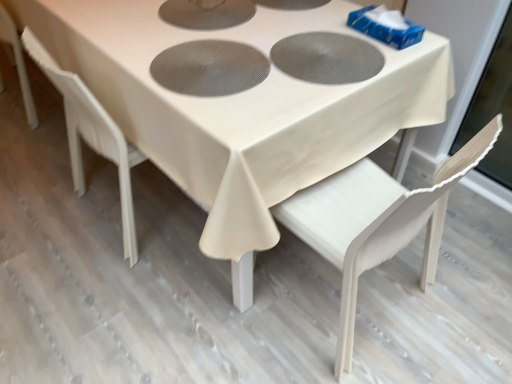
This screenshot has width=512, height=384. What are the coordinates of `white fabric table at center` in the screenshot? It's located at (241, 109).

Which of these two, white fabric table at center or white plastic chair at lower left, arranged as the 2th chair when viewed from the right, is wider?

white fabric table at center is wider.

Between white fabric table at center and white plastic chair at lower left, arranged as the 2th chair when viewed from the right, which one has less height?

Standing shorter between the two is white fabric table at center.

Is white fabric table at center positioned beyond the bounds of white plastic chair at lower left, acting as the first chair starting from the left?

Yes, white fabric table at center is located beyond the bounds of white plastic chair at lower left, acting as the first chair starting from the left.

Which object is positioned more to the left, white fabric table at center or white plastic chair at lower left, arranged as the 2th chair when viewed from the right?

From the viewer's perspective, white fabric table at center appears more on the left side.

Is white fabric table at center positioned far away from white matte chair at lower right, acting as the second chair starting from the left?

white fabric table at center is actually quite close to white matte chair at lower right, acting as the second chair starting from the left.

Could you tell me if white fabric table at center is turned towards white matte chair at lower right, the 1th chair from the right?

No, white fabric table at center is not facing towards white matte chair at lower right, the 1th chair from the right.

Does white fabric table at center have a greater width compared to white matte chair at lower right, the 1th chair from the right?

Yes.

Does white fabric table at center have a larger size compared to white matte chair at lower right, the 1th chair from the right?

Indeed, white fabric table at center has a larger size compared to white matte chair at lower right, the 1th chair from the right.

In the image, is white matte chair at lower right, acting as the second chair starting from the left, positioned in front of or behind white plastic chair at lower left, acting as the first chair starting from the left?

white matte chair at lower right, acting as the second chair starting from the left, is positioned closer to the viewer than white plastic chair at lower left, acting as the first chair starting from the left.

From a real-world perspective, which is physically above, white matte chair at lower right, acting as the second chair starting from the left, or white plastic chair at lower left, arranged as the 2th chair when viewed from the right?

white matte chair at lower right, acting as the second chair starting from the left, from a real-world perspective.

Which is more distant, (361,218) or (85,130)?

Positioned behind is point (85,130).

At what (x,y) coordinates should I click in order to perform the action: click on chair above the white plastic chair at lower left, arranged as the 2th chair when viewed from the right (from a real-world perspective). Please return your answer as a coordinate pair (x, y). Looking at the image, I should click on (375, 222).

From a real-world perspective, is white plastic chair at lower left, arranged as the 2th chair when viewed from the right, physically below white matte chair at lower right, acting as the second chair starting from the left?

Yes.

Considering the sizes of objects white plastic chair at lower left, acting as the first chair starting from the left, and white matte chair at lower right, acting as the second chair starting from the left, in the image provided, who is wider, white plastic chair at lower left, acting as the first chair starting from the left, or white matte chair at lower right, acting as the second chair starting from the left,?

white plastic chair at lower left, acting as the first chair starting from the left.

Visually, is white plastic chair at lower left, acting as the first chair starting from the left, positioned to the left or to the right of white matte chair at lower right, acting as the second chair starting from the left?

In the image, white plastic chair at lower left, acting as the first chair starting from the left, appears on the left side of white matte chair at lower right, acting as the second chair starting from the left.

Looking at the image, does white plastic chair at lower left, acting as the first chair starting from the left, seem bigger or smaller compared to white matte chair at lower right, acting as the second chair starting from the left?

In the image, white plastic chair at lower left, acting as the first chair starting from the left, appears to be larger than white matte chair at lower right, acting as the second chair starting from the left.

Considering the positions of objects white plastic chair at lower left, arranged as the 2th chair when viewed from the right, and white fabric table at center in the image provided, who is more to the left, white plastic chair at lower left, arranged as the 2th chair when viewed from the right, or white fabric table at center?

white fabric table at center is more to the left.

From the picture: From a real-world perspective, who is located lower, white plastic chair at lower left, acting as the first chair starting from the left, or white fabric table at center?

In real-world perspective, white fabric table at center is lower.

Does white plastic chair at lower left, acting as the first chair starting from the left, have a larger size compared to white fabric table at center?

No.

Does white matte chair at lower right, the 1th chair from the right, have a larger size compared to white fabric table at center?

Actually, white matte chair at lower right, the 1th chair from the right, might be smaller than white fabric table at center.

Where is `table above the white matte chair at lower right, the 1th chair from the right (from the image's perspective)`? The width and height of the screenshot is (512, 384). table above the white matte chair at lower right, the 1th chair from the right (from the image's perspective) is located at coordinates (241, 109).

Is white matte chair at lower right, acting as the second chair starting from the left, surrounding white fabric table at center?

Definitely not — white fabric table at center is not inside white matte chair at lower right, acting as the second chair starting from the left.

From the image's perspective, who appears lower, white matte chair at lower right, acting as the second chair starting from the left, or white fabric table at center?

white matte chair at lower right, acting as the second chair starting from the left.

Locate an element on the screen. The image size is (512, 384). chair that is the 1st one above the white fabric table at center (from a real-world perspective) is located at coordinates (91, 135).

Find the location of a particular element. The width and height of the screenshot is (512, 384). table on the left side of white matte chair at lower right, the 1th chair from the right is located at coordinates (241, 109).

Estimate the real-world distances between objects in this image. Which object is closer to white fabric table at center, white plastic chair at lower left, acting as the first chair starting from the left, or white matte chair at lower right, the 1th chair from the right?

white matte chair at lower right, the 1th chair from the right, is closer to white fabric table at center.

Estimate the real-world distances between objects in this image. Which object is further from white matte chair at lower right, the 1th chair from the right, white fabric table at center or white plastic chair at lower left, arranged as the 2th chair when viewed from the right?

Among the two, white plastic chair at lower left, arranged as the 2th chair when viewed from the right, is located further to white matte chair at lower right, the 1th chair from the right.

Estimate the real-world distances between objects in this image. Which object is closer to white plastic chair at lower left, arranged as the 2th chair when viewed from the right, white fabric table at center or white matte chair at lower right, the 1th chair from the right?

white fabric table at center is closer to white plastic chair at lower left, arranged as the 2th chair when viewed from the right.

From the picture: When comparing their distances from white plastic chair at lower left, acting as the first chair starting from the left, does white matte chair at lower right, acting as the second chair starting from the left, or white fabric table at center seem further?

white matte chair at lower right, acting as the second chair starting from the left, lies further to white plastic chair at lower left, acting as the first chair starting from the left, than the other object.

When comparing their distances from white matte chair at lower right, the 1th chair from the right, does white plastic chair at lower left, arranged as the 2th chair when viewed from the right, or white fabric table at center seem further?

Based on the image, white plastic chair at lower left, arranged as the 2th chair when viewed from the right, appears to be further to white matte chair at lower right, the 1th chair from the right.

Considering their positions, is white matte chair at lower right, the 1th chair from the right, positioned further to white fabric table at center than white plastic chair at lower left, arranged as the 2th chair when viewed from the right?

The object further to white fabric table at center is white plastic chair at lower left, arranged as the 2th chair when viewed from the right.

Locate an element on the screen. The height and width of the screenshot is (384, 512). chair between white fabric table at center and white matte chair at lower right, the 1th chair from the right is located at coordinates (91, 135).